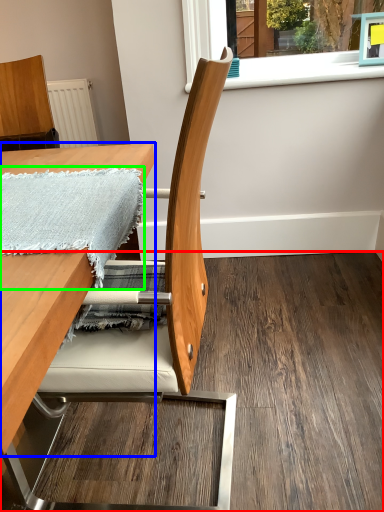
Question: Considering the real-world distances, which object is farthest from plywood (highlighted by a red box)? table (highlighted by a blue box) or blanket (highlighted by a green box)?

Choices:
 (A) table
 (B) blanket

Answer: (A)